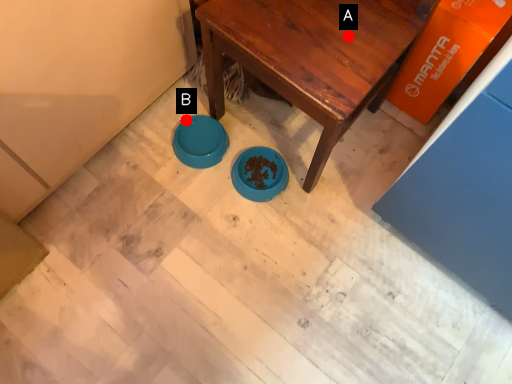
Question: Two points are circled on the image, labeled by A and B beside each circle. Among these points, which one is nearest to the camera?

Choices:
 (A) A is closer
 (B) B is closer

Answer: (A)